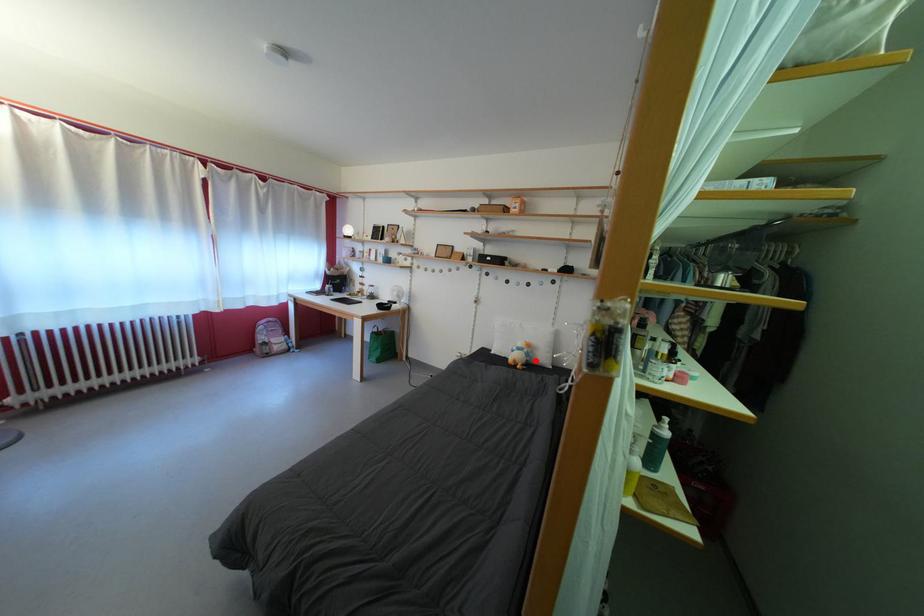
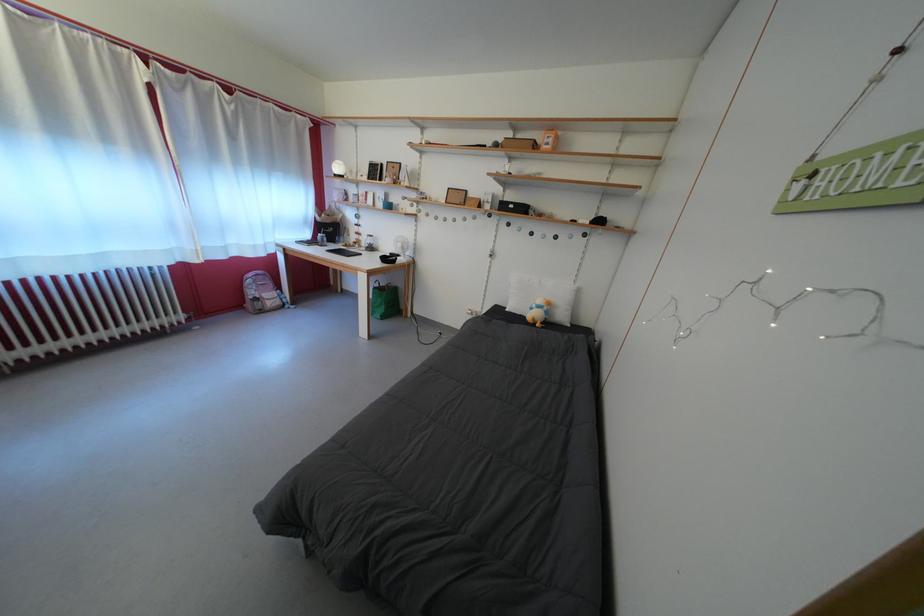
Question: A red point is marked in image1. In image2, is the corresponding 3D point closer to the camera or farther? Reply with the corresponding letter.

Choices:
 (A) The corresponding 3D point is closer.
 (B) The corresponding 3D point is farther.

Answer: (A)